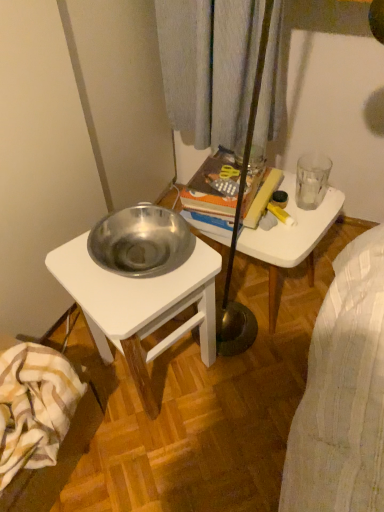
Find the location of a particular element. This screenshot has width=384, height=512. empty space that is in between polished silver bowl at left and striped cotton blanket at lower left is located at coordinates (105, 433).